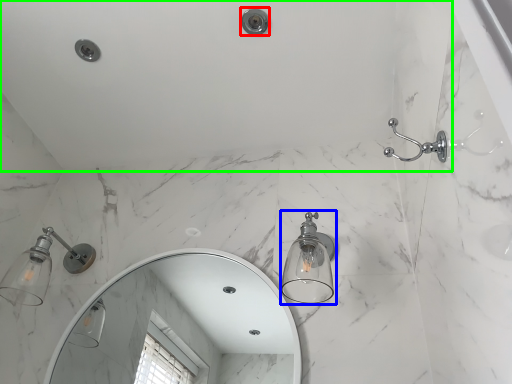
Question: Estimate the real-world distances between objects in this image. Which object is closer to shower (highlighted by a red box), light fixture (highlighted by a blue box) or bath (highlighted by a green box)?

Choices:
 (A) light fixture
 (B) bath

Answer: (B)